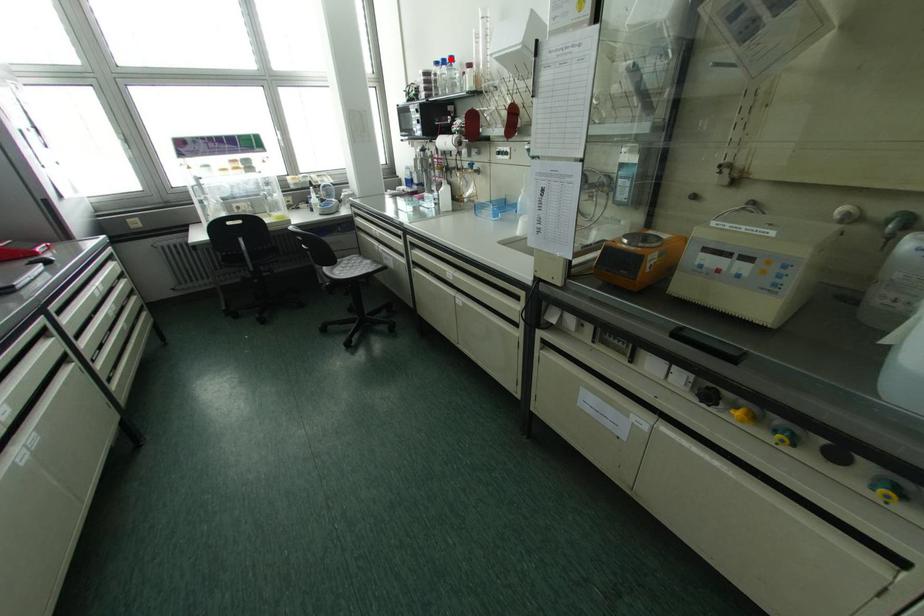
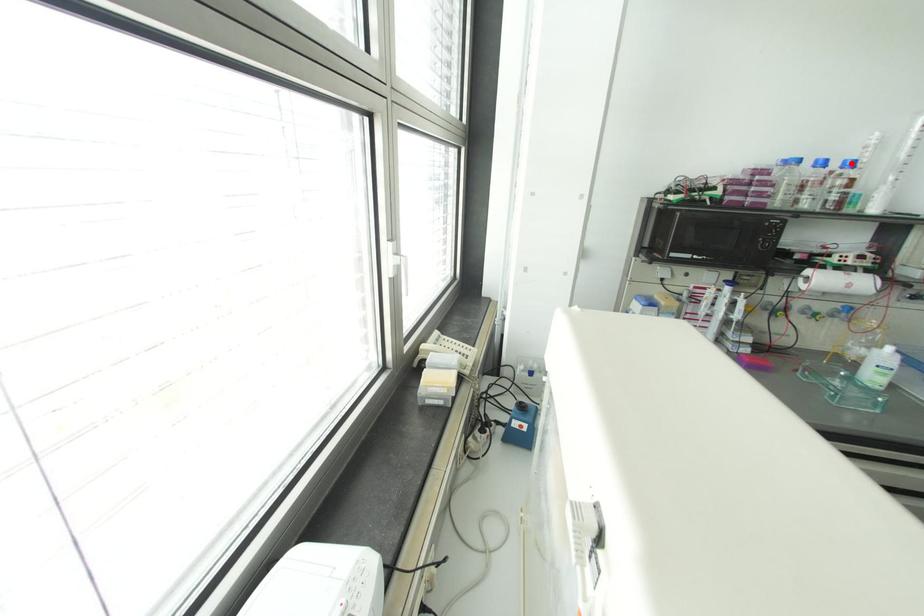
I am providing you with two images of the same scene from different viewpoints. A red point is marked on the first image and another point is marked on the second image. Are the points marked in image1 and image2 representing the same 3D position?

Yes